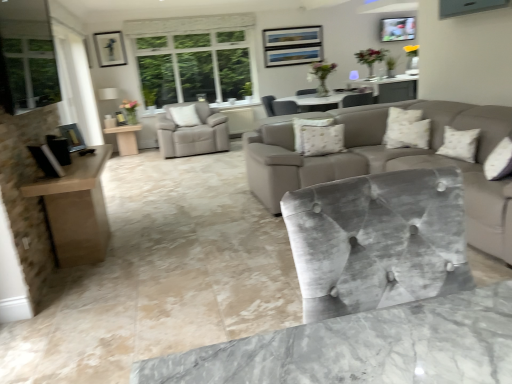
Question: Is white textured pillow at center, the first pillow when ordered from bottom to top, positioned before beige fabric pillow at center, the third pillow when ordered from front to back?

Choices:
 (A) yes
 (B) no

Answer: (A)

Question: Can you confirm if white textured pillow at center, which is counted as the second pillow, starting from the back, is positioned to the right of beige fabric pillow at center, marked as the 3th pillow in a bottom-to-top arrangement?

Choices:
 (A) no
 (B) yes

Answer: (B)

Question: Does white textured pillow at center, which is the second pillow in front-to-back order, have a greater height compared to beige fabric pillow at center, positioned as the 1th pillow in back-to-front order?

Choices:
 (A) no
 (B) yes

Answer: (A)

Question: Is white textured pillow at center, the first pillow when ordered from bottom to top, positioned beyond the bounds of beige fabric pillow at center, positioned as the 1th pillow in back-to-front order?

Choices:
 (A) no
 (B) yes

Answer: (B)

Question: Is white textured pillow at center, the third pillow in the top-to-bottom sequence, positioned with its back to beige fabric pillow at center, marked as the 3th pillow in a bottom-to-top arrangement?

Choices:
 (A) yes
 (B) no

Answer: (A)

Question: Considering the positions of velvet gray chair at center, placed as the second chair when sorted from left to right, and velvet grey chair at center, placed as the 3th chair when sorted from left to right, in the image, is velvet gray chair at center, placed as the second chair when sorted from left to right, bigger or smaller than velvet grey chair at center, placed as the 3th chair when sorted from left to right,?

Choices:
 (A) small
 (B) big

Answer: (B)

Question: In terms of height, does velvet gray chair at center, which appears as the first chair when viewed from the front, look taller or shorter compared to velvet grey chair at center, positioned as the second chair in bottom-to-top order?

Choices:
 (A) tall
 (B) short

Answer: (A)

Question: Is velvet gray chair at center, placed as the 1th chair when sorted from bottom to top, to the left or to the right of velvet grey chair at center, the 2th chair from the top, in the image?

Choices:
 (A) left
 (B) right

Answer: (A)

Question: Is velvet gray chair at center, arranged as the second chair when viewed from the right, wider or thinner than velvet grey chair at center, the 2th chair from the top?

Choices:
 (A) thin
 (B) wide

Answer: (B)

Question: Is point (33, 79) closer or farther from the camera than point (267, 102)?

Choices:
 (A) farther
 (B) closer

Answer: (B)

Question: From their relative heights in the image, would you say clear glass window at left is taller or shorter than velvet grey chair at center, positioned as the second chair in bottom-to-top order?

Choices:
 (A) short
 (B) tall

Answer: (B)

Question: From the image's perspective, is clear glass window at left positioned above or below velvet grey chair at center, positioned as the second chair in bottom-to-top order?

Choices:
 (A) below
 (B) above

Answer: (A)

Question: In terms of width, does clear glass window at left look wider or thinner when compared to velvet grey chair at center, which is the 1th chair in right-to-left order?

Choices:
 (A) wide
 (B) thin

Answer: (B)

Question: Is white textured pillow at center, which is the second pillow in front-to-back order, taller or shorter than white textured pillow at upper right, the first pillow positioned from the front?

Choices:
 (A) short
 (B) tall

Answer: (A)

Question: Is white textured pillow at center, which is counted as the second pillow, starting from the right, to the left or to the right of white textured pillow at upper right, the second pillow in the top-to-bottom sequence, in the image?

Choices:
 (A) left
 (B) right

Answer: (A)